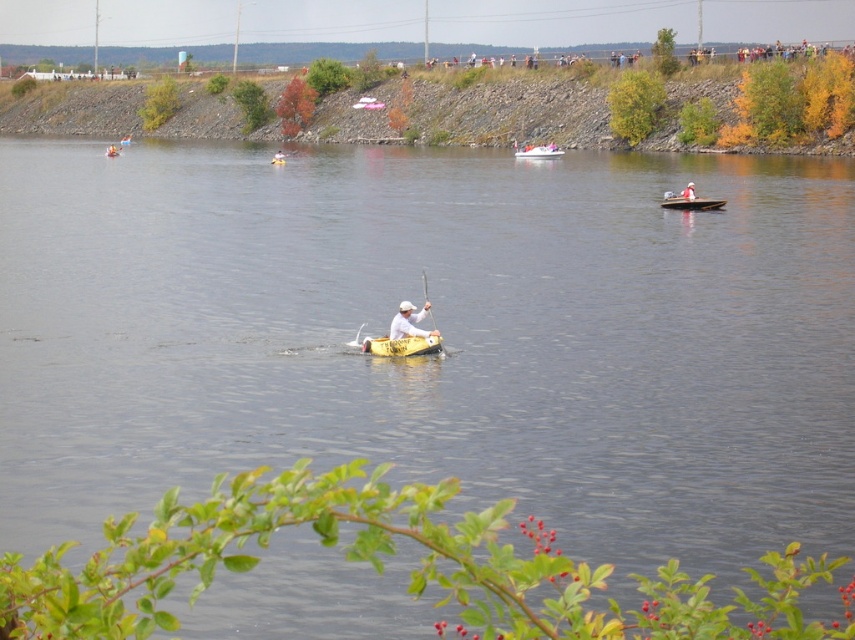
Question: Is the position of yellow matte canoe at center more distant than that of yellow plastic boat at center?

Choices:
 (A) yes
 (B) no

Answer: (B)

Question: Which is nearer to the yellow plastic boat at center?

Choices:
 (A) white matte kayak at center
 (B) yellow plastic kayak at center
 (C) yellow matte canoe at center

Answer: (B)

Question: Which object is the farthest from the yellow plastic boat at center?

Choices:
 (A) yellow matte canoe at center
 (B) wooden canoe at right
 (C) white matte kayak at center
 (D) yellow plastic kayak at center

Answer: (C)

Question: Based on their relative distances, which object is nearer to the white wood paddle at center?

Choices:
 (A) yellow plastic boat at center
 (B) wooden canoe at right
 (C) yellow matte canoe at center

Answer: (C)

Question: From the image, what is the correct spatial relationship of white matte kayak at center in relation to white wood paddle at center?

Choices:
 (A) left
 (B) right

Answer: (A)

Question: Observing the image, what is the correct spatial positioning of yellow matte canoe at center in reference to white wood paddle at center?

Choices:
 (A) above
 (B) below

Answer: (B)